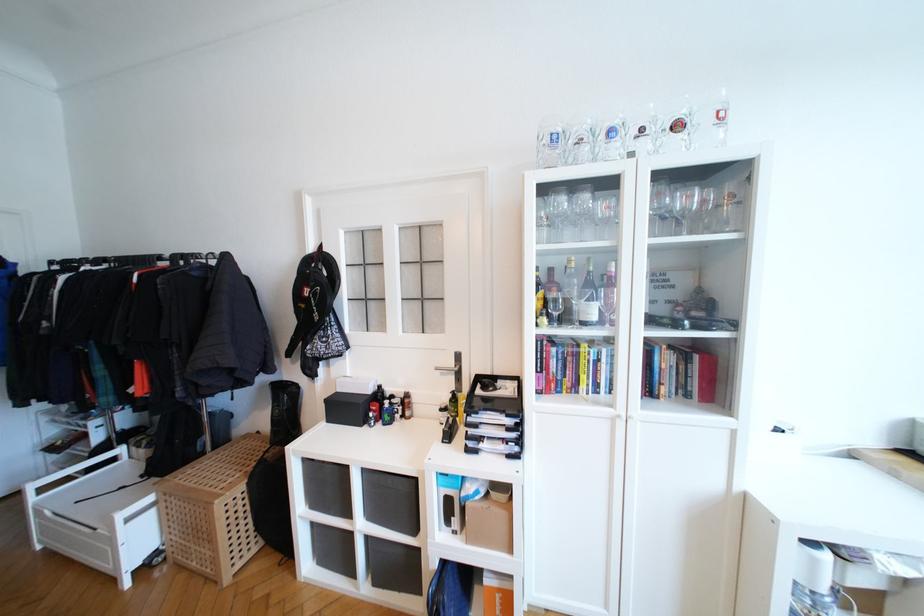
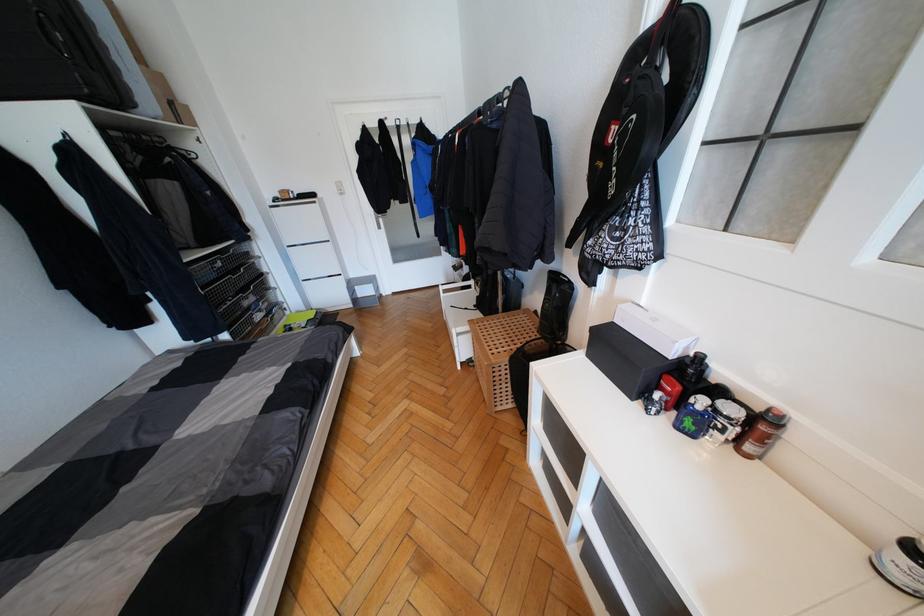
In the second image, find the point that corresponds to pixel 390 419 in the first image.

(691, 426)